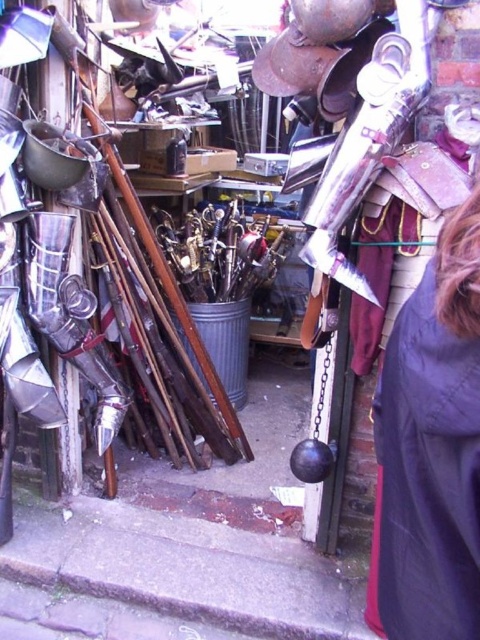
Question: Which object is farther from the camera taking this photo?

Choices:
 (A) dark gray fabric cape at lower right
 (B) metallic sheen sword at center

Answer: (B)

Question: Can you confirm if dark gray fabric cape at lower right is bigger than metallic sheen sword at center?

Choices:
 (A) yes
 (B) no

Answer: (B)

Question: Is dark gray fabric cape at lower right to the left of metallic sheen sword at center from the viewer's perspective?

Choices:
 (A) no
 (B) yes

Answer: (A)

Question: Which object appears closest to the camera in this image?

Choices:
 (A) metallic sheen sword at center
 (B) dark gray fabric cape at lower right

Answer: (B)

Question: Which object appears closest to the camera in this image?

Choices:
 (A) dark gray fabric cape at lower right
 (B) metallic sheen sword at center

Answer: (A)

Question: Is dark gray fabric cape at lower right smaller than metallic sheen sword at center?

Choices:
 (A) no
 (B) yes

Answer: (B)